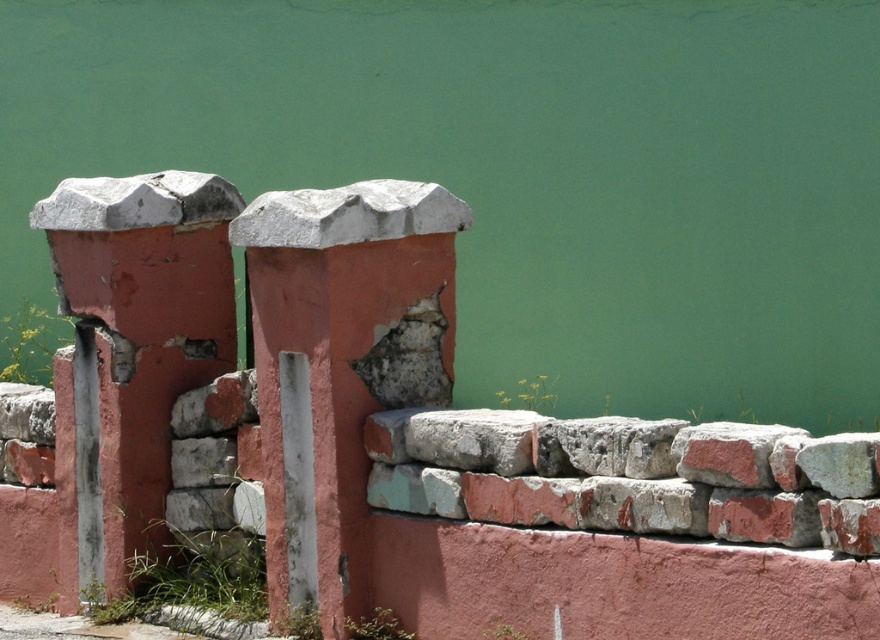
You are a painter who needs to move a ladder from the rusty stone brick at lower right to the rusty concrete pillar at center. The ladder is 1.5 meters long. Can you place the ladder between them without it touching the ground?

The distance between the rusty concrete pillar at center and the rusty stone brick at lower right is 1.51 meters. Since the ladder is only 1.5 meters long, it would be 1 centimeter too short to span the gap. You would need a slightly longer ladder to safely place it between them without touching the ground.

From the picture: You are a maintenance worker assessing the structure of the stone wall. You notice the rusty concrete pillar at center and the rusty brick stone at center. Which object is positioned higher in the scene?

The rusty concrete pillar at center is above the rusty brick stone at center, so it is positioned higher in the scene.

You are a painter holding a 24 inch wide brush. You need to paint both the rusty concrete pillar at center and the rusty brick stone at center. Can you fit your brush between them without moving either object?

The distance between the rusty concrete pillar at center and the rusty brick stone at center is 22.52 inches. Since your brush is 24 inches wide, it cannot fit between them as the space is narrower than the brush.